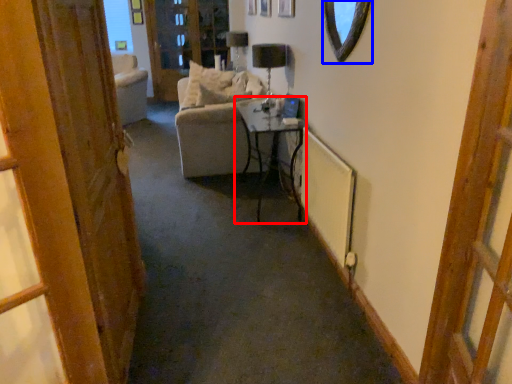
Question: Among these objects, which one is farthest to the camera, table (highlighted by a red box) or mirror (highlighted by a blue box)?

Choices:
 (A) table
 (B) mirror

Answer: (A)